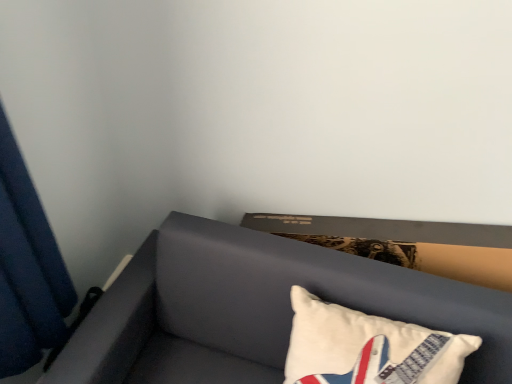
Question: Is suede-like gray sofa at lower right looking in the opposite direction of white cotton pillow at lower right?

Choices:
 (A) no
 (B) yes

Answer: (B)

Question: From a real-world perspective, is suede-like gray sofa at lower right located higher than white cotton pillow at lower right?

Choices:
 (A) yes
 (B) no

Answer: (B)

Question: From the image's perspective, is suede-like gray sofa at lower right located above white cotton pillow at lower right?

Choices:
 (A) yes
 (B) no

Answer: (B)

Question: Is the depth of suede-like gray sofa at lower right greater than that of white cotton pillow at lower right?

Choices:
 (A) no
 (B) yes

Answer: (A)

Question: Does suede-like gray sofa at lower right have a larger size compared to white cotton pillow at lower right?

Choices:
 (A) yes
 (B) no

Answer: (A)

Question: Does suede-like gray sofa at lower right turn towards white cotton pillow at lower right?

Choices:
 (A) no
 (B) yes

Answer: (B)

Question: Is blue fabric curtain at left smaller than suede-like gray sofa at lower right?

Choices:
 (A) no
 (B) yes

Answer: (B)

Question: Considering the relative positions of blue fabric curtain at left and suede-like gray sofa at lower right in the image provided, is blue fabric curtain at left to the left of suede-like gray sofa at lower right from the viewer's perspective?

Choices:
 (A) no
 (B) yes

Answer: (B)

Question: Can you see blue fabric curtain at left touching suede-like gray sofa at lower right?

Choices:
 (A) no
 (B) yes

Answer: (A)

Question: From the image's perspective, is blue fabric curtain at left under suede-like gray sofa at lower right?

Choices:
 (A) no
 (B) yes

Answer: (A)

Question: Is blue fabric curtain at left taller than suede-like gray sofa at lower right?

Choices:
 (A) no
 (B) yes

Answer: (B)

Question: From the image's perspective, is blue fabric curtain at left on top of suede-like gray sofa at lower right?

Choices:
 (A) yes
 (B) no

Answer: (A)

Question: Can you confirm if blue fabric curtain at left is thinner than white cotton pillow at lower right?

Choices:
 (A) no
 (B) yes

Answer: (B)